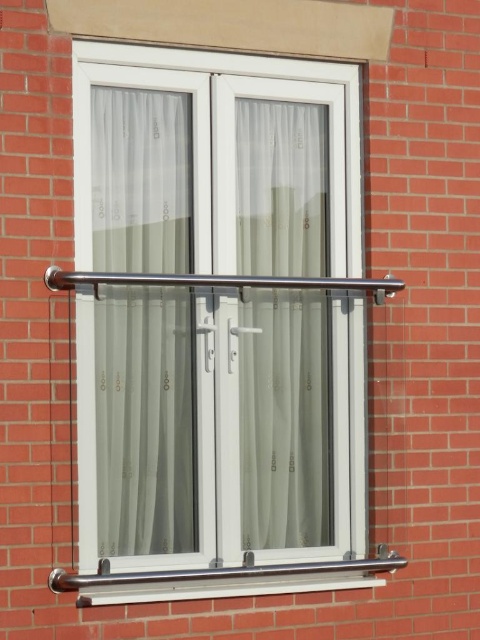
Between white plastic glass door at center and polished stainless steel handrail at center, which one appears on the left side from the viewer's perspective?

white plastic glass door at center

Is point (343, 257) more distant than point (284, 276)?

Yes, point (343, 257) is farther from viewer.

Image resolution: width=480 pixels, height=640 pixels. What are the coordinates of `white plastic glass door at center` in the screenshot? It's located at (218, 426).

Is point (248, 100) positioned before point (310, 285)?

No, it is behind (310, 285).

From the picture: Does translucent fabric curtain at center appear over polished stainless steel handrail at center?

No, translucent fabric curtain at center is not above polished stainless steel handrail at center.

Between point (319, 410) and point (288, 289), which one is positioned behind?

The point (319, 410) is more distant.

In order to click on translucent fabric curtain at center in this screenshot , I will do `click(284, 420)`.

Based on the photo, is sheer fabric curtain at center to the right of white plastic window sill at lower center from the viewer's perspective?

No, sheer fabric curtain at center is not to the right of white plastic window sill at lower center.

Which is behind, point (156, 273) or point (55, 577)?

The point (156, 273) is more distant.

Between point (172, 328) and point (355, 564), which one is positioned in front?

Point (172, 328) is more forward.

At what (x,y) coordinates should I click in order to perform the action: click on sheer fabric curtain at center. Please return your answer as a coordinate pair (x, y). The width and height of the screenshot is (480, 640). Looking at the image, I should click on (144, 420).